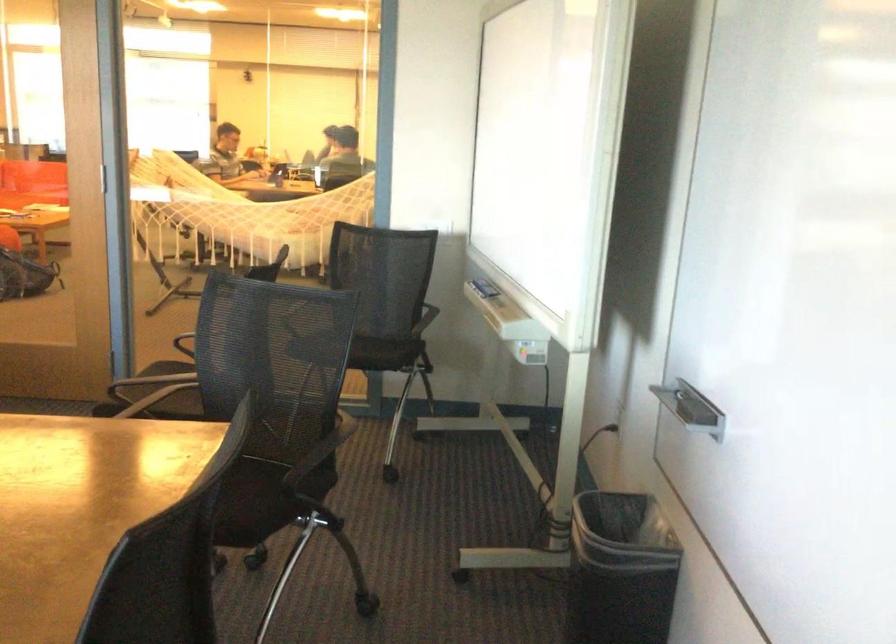
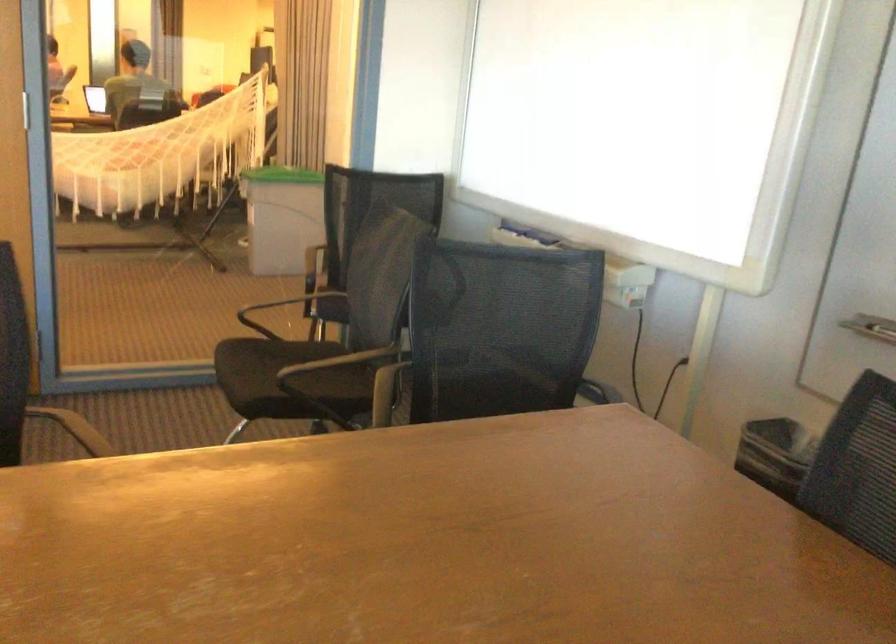
Find the pixel in the second image that matches point 168,395 in the first image.

(288, 379)